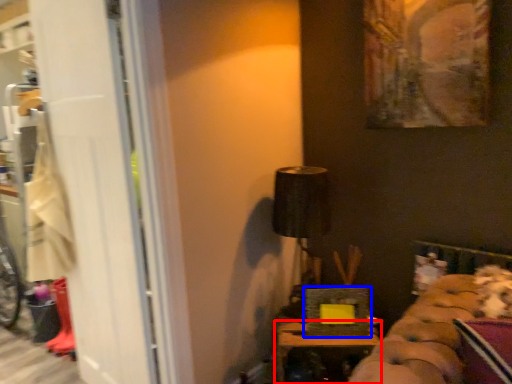
Question: Which point is closer to the camera, furniture (highlighted by a red box) or picture frame (highlighted by a blue box)?

Choices:
 (A) furniture
 (B) picture frame

Answer: (A)